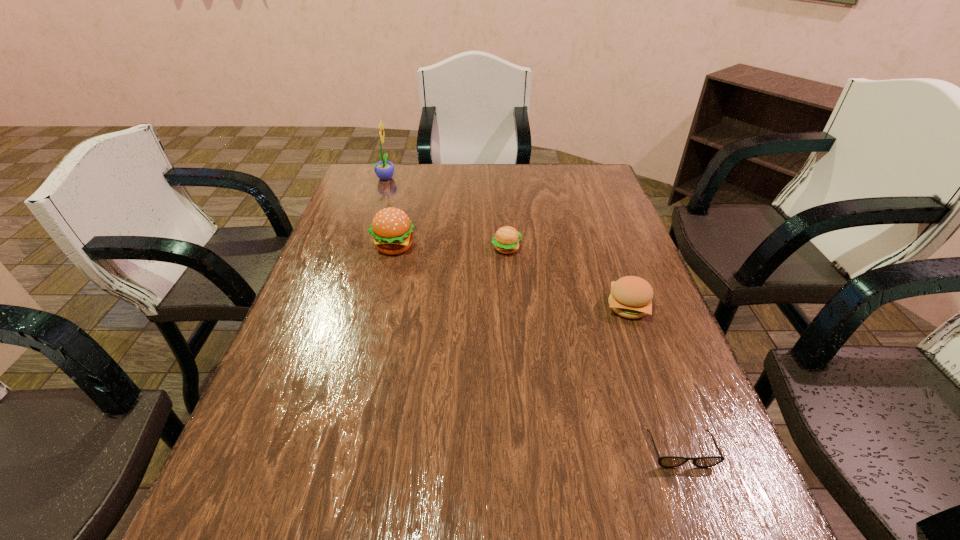
Locate an element on the screen. free spot between the second tallest hamburger and the tallest hamburger is located at coordinates (511, 276).

In order to click on vacant space that's between the leftmost hamburger and the nearest object in this screenshot , I will do `click(537, 348)`.

Locate an element on the screen. This screenshot has width=960, height=540. blank region between the third object from left to right and the sunflower is located at coordinates (446, 213).

Where is `empty space between the second tallest object and the fourth farthest object`? empty space between the second tallest object and the fourth farthest object is located at coordinates (511, 276).

The height and width of the screenshot is (540, 960). Find the location of `empty space between the fourth farthest object and the tallest hamburger`. empty space between the fourth farthest object and the tallest hamburger is located at coordinates (511, 276).

Identify which object is the fourth closest to the third object from left to right. Please provide its 2D coordinates. Your answer should be formatted as a tuple, i.e. [(x, y)], where the tuple contains the x and y coordinates of a point satisfying the conditions above.

[(666, 461)]

Locate which object ranks third in proximity to the third object from left to right. Please provide its 2D coordinates. Your answer should be formatted as a tuple, i.e. [(x, y)], where the tuple contains the x and y coordinates of a point satisfying the conditions above.

[(384, 170)]

Choose which hamburger is the third nearest neighbor to the sunflower. Please provide its 2D coordinates. Your answer should be formatted as a tuple, i.e. [(x, y)], where the tuple contains the x and y coordinates of a point satisfying the conditions above.

[(631, 297)]

Where is `hamburger that stands as the closest to the rightmost hamburger`? This screenshot has height=540, width=960. hamburger that stands as the closest to the rightmost hamburger is located at coordinates (506, 240).

You are a GUI agent. You are given a task and a screenshot of the screen. Output one action in this format:
    pyautogui.click(x=<x>, y=<y>)
    Task: Click on the vacant space that satisfies the following two spatial constraints: 1. on the front side of the leftmost hamburger; 2. on the left side of the shortest hamburger
    
    Given the screenshot: What is the action you would take?
    pyautogui.click(x=394, y=248)